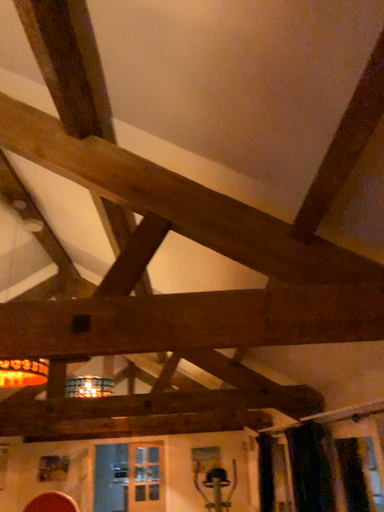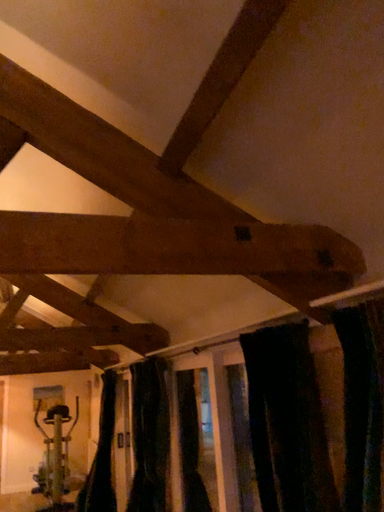
Question: Which way did the camera rotate in the video?

Choices:
 (A) rotated left
 (B) rotated right

Answer: (B)